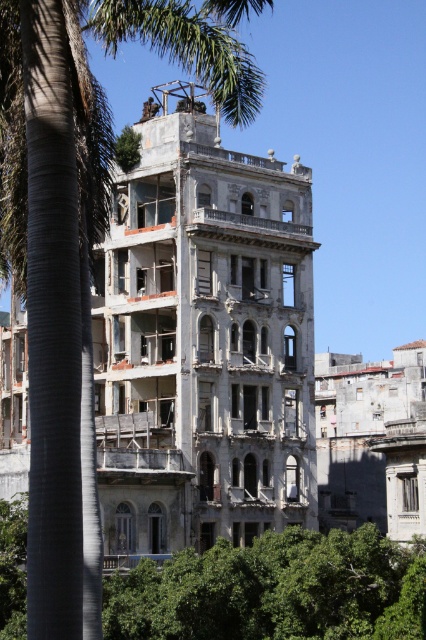
Question: Is green leafy palm tree at left thinner than green leafy tree at center?

Choices:
 (A) no
 (B) yes

Answer: (B)

Question: Is green leafy palm tree at left positioned before green leafy tree at center?

Choices:
 (A) no
 (B) yes

Answer: (B)

Question: Which object is farther from the camera taking this photo?

Choices:
 (A) green leafy palm tree at left
 (B) green leafy tree at center

Answer: (B)

Question: Can you confirm if green leafy palm tree at left is wider than green leafy tree at center?

Choices:
 (A) yes
 (B) no

Answer: (B)

Question: Among these points, which one is nearest to the camera?

Choices:
 (A) (74, 512)
 (B) (250, 625)

Answer: (A)